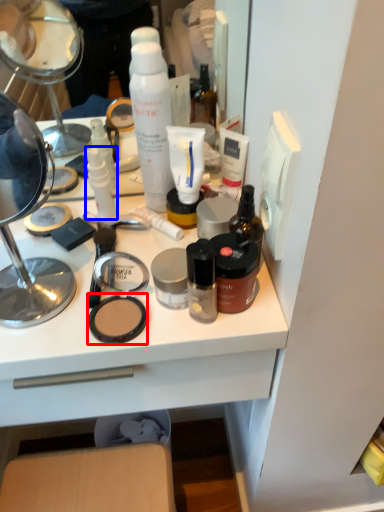
Question: Which of the following is the closest to the observer, face powder (highlighted by a red box) or toiletry (highlighted by a blue box)?

Choices:
 (A) face powder
 (B) toiletry

Answer: (A)